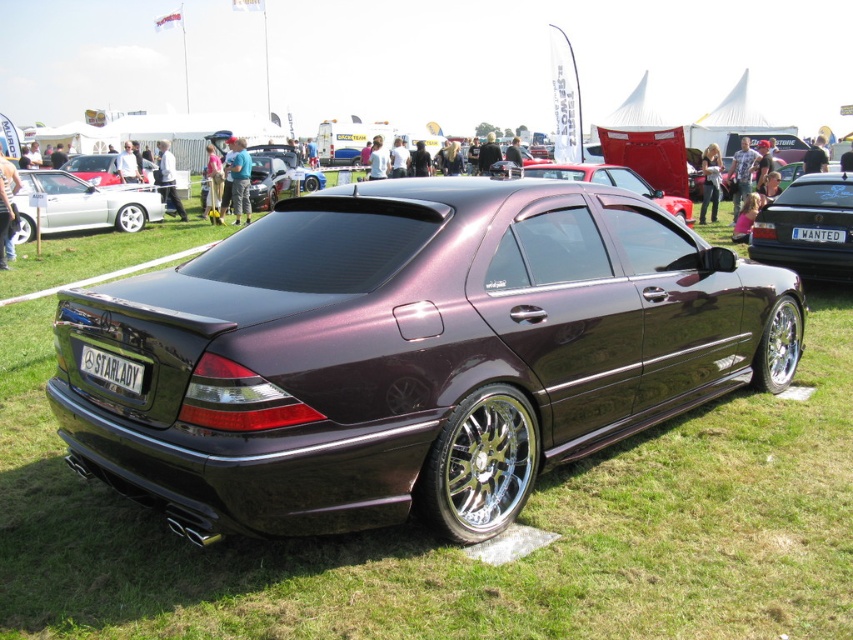
Can you confirm if satin black sedan at center is taller than shiny metallic car at center?

In fact, satin black sedan at center may be shorter than shiny metallic car at center.

Who is positioned more to the right, satin black sedan at center or shiny metallic car at center?

Positioned to the right is shiny metallic car at center.

What do you see at coordinates (93, 168) in the screenshot?
I see `satin black sedan at center` at bounding box center [93, 168].

At what (x,y) coordinates should I click in order to perform the action: click on satin black sedan at center. Please return your answer as a coordinate pair (x, y). Image resolution: width=853 pixels, height=640 pixels. Looking at the image, I should click on (93, 168).

Does metallic maroon sedan at center have a greater height compared to satin black sedan at center?

Yes, metallic maroon sedan at center is taller than satin black sedan at center.

At what (x,y) coordinates should I click in order to perform the action: click on metallic maroon sedan at center. Please return your answer as a coordinate pair (x, y). Looking at the image, I should click on (807, 227).

You are a GUI agent. You are given a task and a screenshot of the screen. Output one action in this format:
    pyautogui.click(x=<x>, y=<y>)
    Task: Click on the metallic maroon sedan at center
    The image size is (853, 640).
    Given the screenshot: What is the action you would take?
    pyautogui.click(x=807, y=227)

Is glossy metallic car at center bigger than white plastic license plate at center?

Correct, glossy metallic car at center is larger in size than white plastic license plate at center.

Is glossy metallic car at center thinner than white plastic license plate at center?

Incorrect, glossy metallic car at center's width is not less than white plastic license plate at center's.

Who is more distant from viewer, [633,292] or [840,237]?

Positioned behind is point [840,237].

This screenshot has width=853, height=640. I want to click on glossy metallic car at center, so click(x=403, y=355).